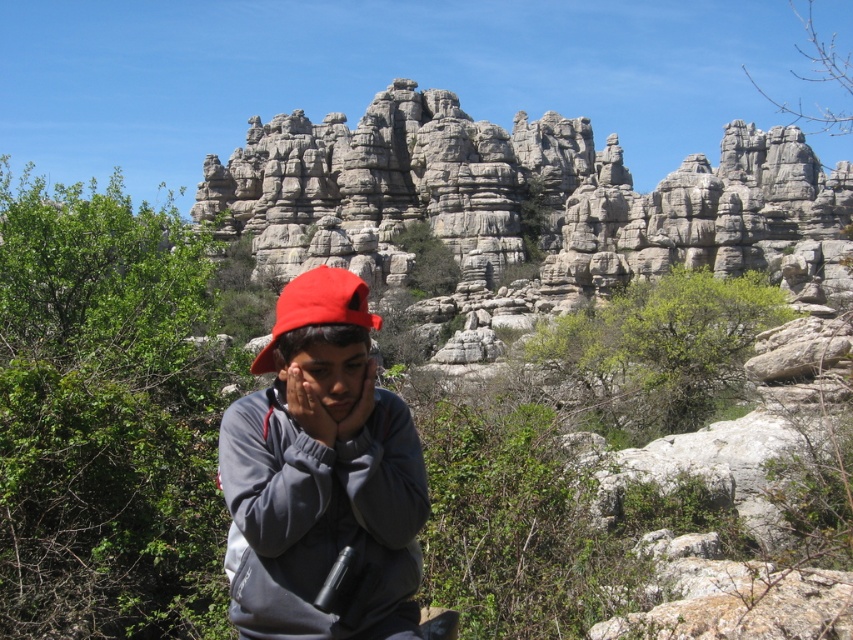
Question: Which point is closer to the camera?

Choices:
 (A) (813, 225)
 (B) (358, 298)
 (C) (248, 497)

Answer: (C)

Question: Does gray rocky cliff at center appear on the left side of red fabric hat at center?

Choices:
 (A) yes
 (B) no

Answer: (B)

Question: Which object appears farthest from the camera in this image?

Choices:
 (A) gray rocky cliff at center
 (B) matte gray sweatshirt at center
 (C) red fabric hat at center

Answer: (A)

Question: Does matte gray sweatshirt at center appear over red fabric hat at center?

Choices:
 (A) yes
 (B) no

Answer: (B)

Question: In this image, where is gray rocky cliff at center located relative to matte gray sweatshirt at center?

Choices:
 (A) above
 (B) below

Answer: (A)

Question: Which object is closer to the camera taking this photo?

Choices:
 (A) gray rocky cliff at center
 (B) red fabric hat at center

Answer: (B)